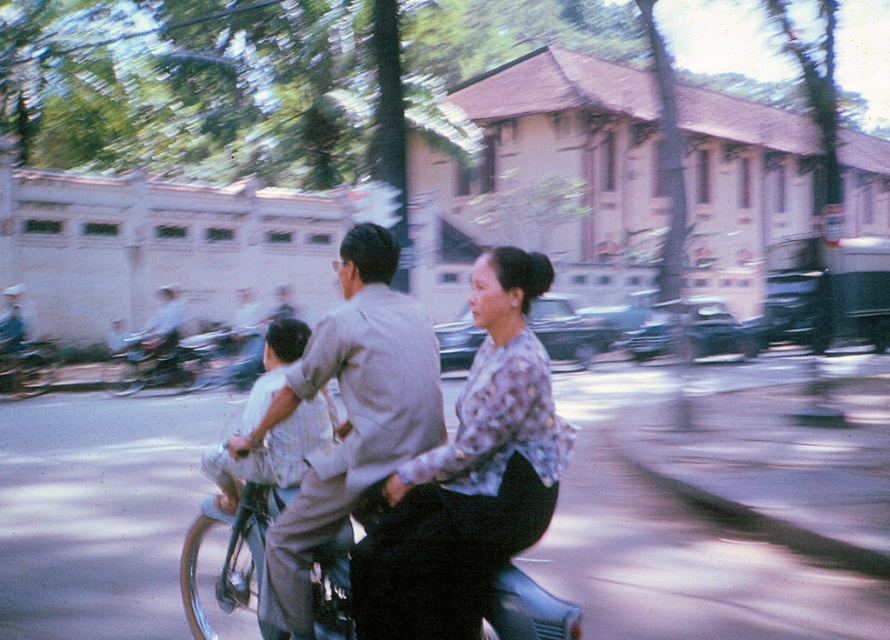
Question: Which of the following is the closest to the observer?

Choices:
 (A) (467, 577)
 (B) (427, 376)

Answer: (A)

Question: From the image, what is the correct spatial relationship of floral-patterned blouse at center in relation to light gray shirt at center?

Choices:
 (A) above
 (B) below

Answer: (B)

Question: Which of the following is the closest to the observer?

Choices:
 (A) light gray shirt at center
 (B) floral-patterned blouse at center

Answer: (B)

Question: Is floral-patterned blouse at center thinner than light gray shirt at center?

Choices:
 (A) yes
 (B) no

Answer: (A)

Question: Which of the following is the farthest from the observer?

Choices:
 (A) floral-patterned blouse at center
 (B) light gray shirt at center

Answer: (B)

Question: Does floral-patterned blouse at center have a larger size compared to light gray shirt at center?

Choices:
 (A) yes
 (B) no

Answer: (B)